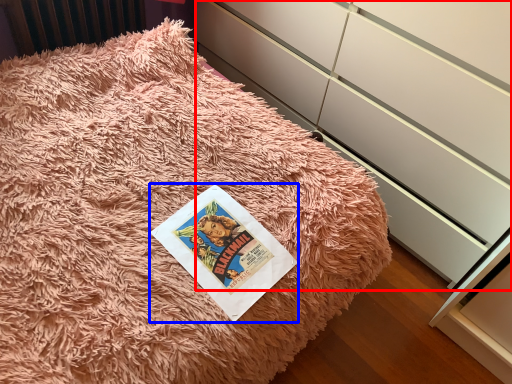
Question: Which of the following is the closest to the observer, cabinetry (highlighted by a red box) or paperback book (highlighted by a blue box)?

Choices:
 (A) cabinetry
 (B) paperback book

Answer: (A)